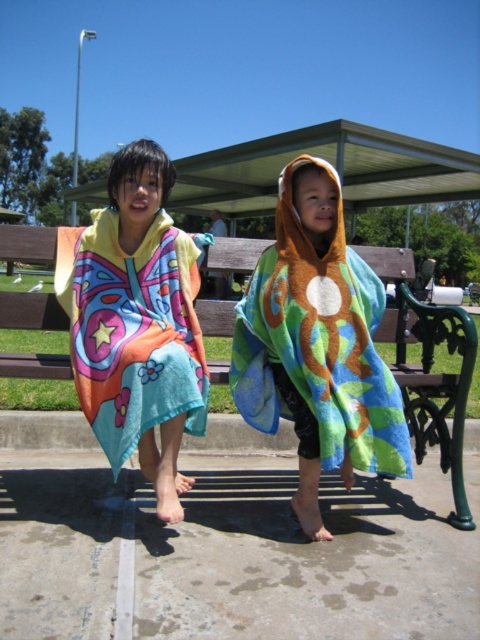
You are a photographer trying to capture both the multicolored towel at center and the multicolored towel at left in a single photo. Which towel should you focus on first to ensure both are in the frame?

You should focus on the multicolored towel at center first because it is closer to you than the multicolored towel at left, allowing you to frame both effectively.

Based on the photo, you are a photographer setting up a shot of the two children under the bright sunlight. You want to ensure the multicolored towel at center and the brown wooden bench at center are both visible in the frame. Given their sizes, which object will appear larger in the photo?

The multicolored towel at center will appear larger in the photo because it is much taller than the brown wooden bench at center.

You are a photographer trying to capture a photo of the multicolored towel at center and the brown wooden bench at center. If you want to include both in the frame without moving them, which object should you position closer to the camera to ensure both fit?

The multicolored towel at center is to the left of the brown wooden bench at center. To include both in the frame, position the multicolored towel at center closer to the camera so that both objects can be captured without moving them.